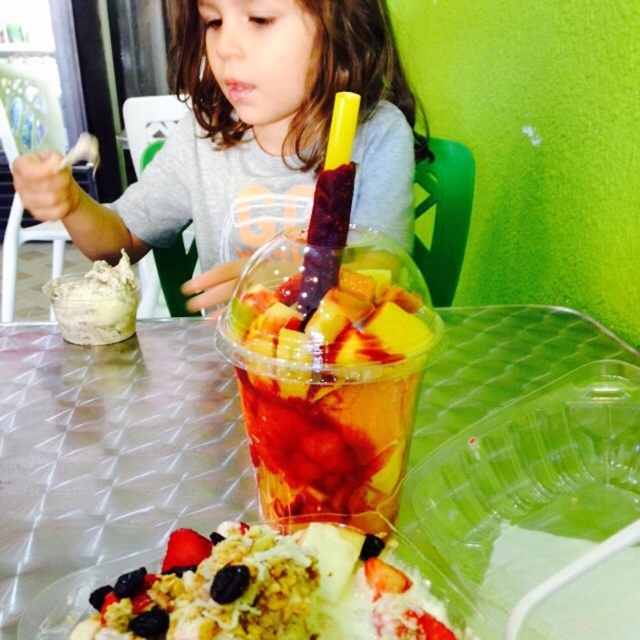
You are a photographer trying to capture a closeup of the fruit salad in the image. You notice two points marked in the scene. One is at point (355, 51) and the other at point (257, 554). Which point should you focus on to ensure the fruit salad is in sharp focus?

You should focus on point (355, 51) because it is closer to the camera than point (257, 554), ensuring the fruit salad is in sharp focus.

You are a parent trying to place a small toy between the translucent plastic cup at center and the shiny granola topped with sliced fruits at center on the table. The toy is 3 inches long. Can you fit it between them without moving either item?

The distance between the translucent plastic cup at center and the shiny granola topped with sliced fruits at center is 3.44 inches. Since the toy is 3 inches long, it can fit between them as there is enough space.

You are a photographer taking a picture of the matte gray shirt at upper left and the shiny granola topped with sliced fruits at center. Which object should you focus on first to ensure it is in the foreground?

The matte gray shirt at upper left is much taller than the shiny granola topped with sliced fruits at center, so focusing on the matte gray shirt at upper left first would place it in the foreground.